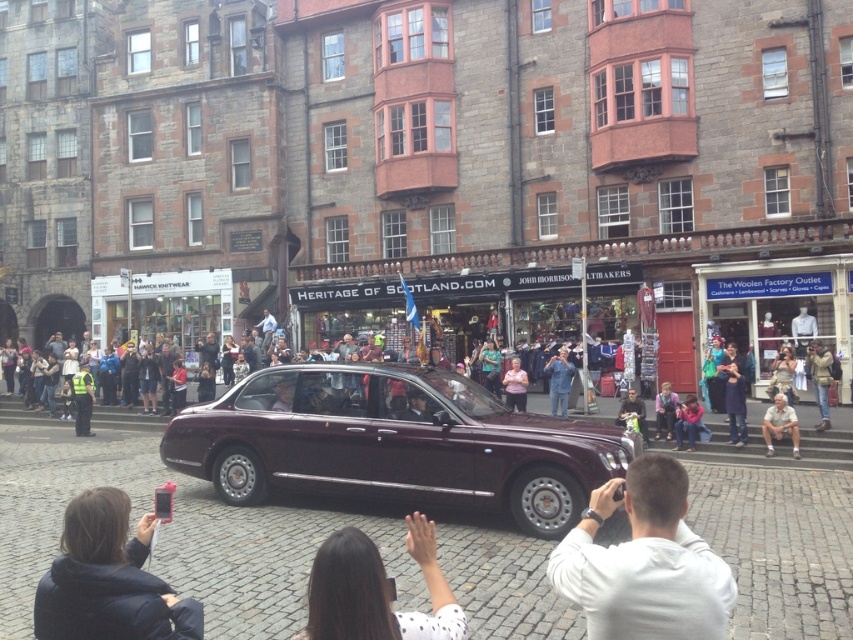
Question: Which point is farther from the camera taking this photo?

Choices:
 (A) (569, 364)
 (B) (688, 432)
 (C) (563, 468)

Answer: (A)

Question: Which of the following is the closest to the observer?

Choices:
 (A) denim jacket at lower right
 (B) dark brown hair at center
 (C) maroon metallic car at center

Answer: (B)

Question: Is maroon metallic car at center to the left of reflective yellow vest at left from the viewer's perspective?

Choices:
 (A) no
 (B) yes

Answer: (A)

Question: Is tan fabric pants at lower right wider than green fabric bag at center?

Choices:
 (A) no
 (B) yes

Answer: (B)

Question: Which point appears closest to the camera in this image?

Choices:
 (A) (682, 426)
 (B) (509, 378)
 (C) (374, 625)

Answer: (C)

Question: Where is denim jacket at lower right located in relation to pink fabric jacket at lower center in the image?

Choices:
 (A) below
 (B) above

Answer: (B)